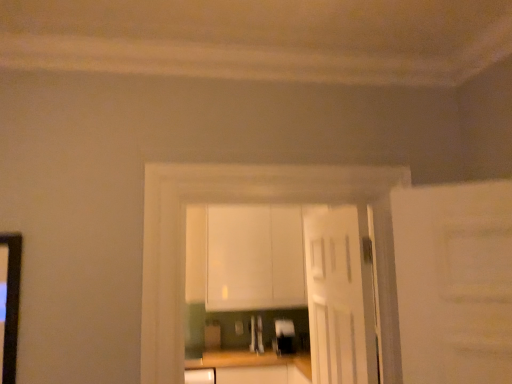
What are the coordinates of `free point above white glossy cabinets at center (from a real-world perspective)` in the screenshot? It's located at (281, 158).